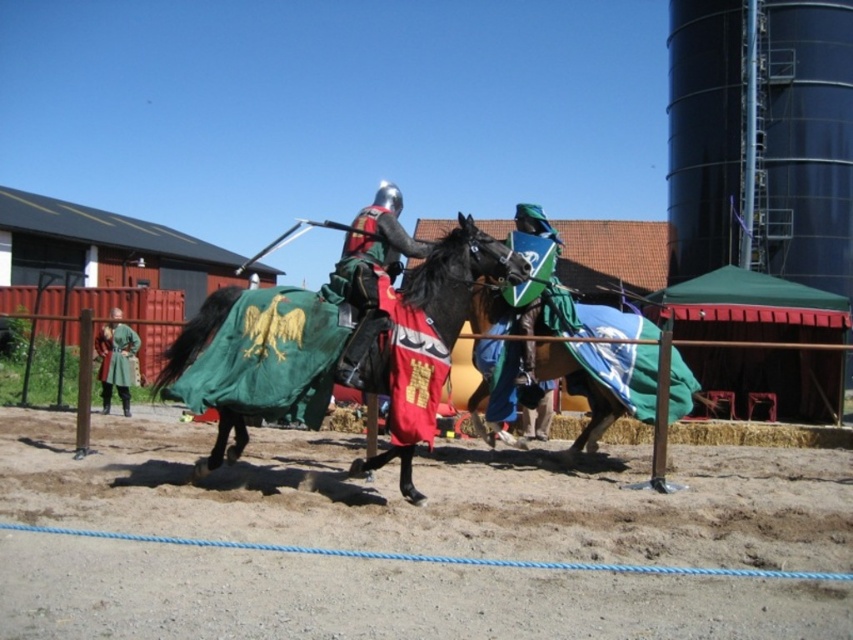
Does brown sandy dirt at center have a greater width compared to green leather jacket at left?

Indeed, brown sandy dirt at center has a greater width compared to green leather jacket at left.

Between brown sandy dirt at center and green leather jacket at left, which one has more height?

green leather jacket at left

Locate an element on the screen. The height and width of the screenshot is (640, 853). brown sandy dirt at center is located at coordinates (432, 497).

Identify the location of brown sandy dirt at center. This screenshot has height=640, width=853. (432, 497).

Between shiny metallic armor at center and shiny brown horse at center, which one has less height?

With less height is shiny brown horse at center.

From the picture: Who is more forward, (364,308) or (474,417)?

Point (364,308)

Is point (392, 257) closer to viewer compared to point (581, 435)?

Yes.

Where is `shiny metallic armor at center`? shiny metallic armor at center is located at coordinates (369, 273).

Can you confirm if green velvet horse at center is shorter than shiny green shield at center?

Yes.

Between green velvet horse at center and shiny green shield at center, which one appears on the right side from the viewer's perspective?

Positioned to the right is shiny green shield at center.

Which is behind, point (262, 352) or point (546, 280)?

The point (546, 280) is behind.

Locate an element on the screen. Image resolution: width=853 pixels, height=640 pixels. green velvet horse at center is located at coordinates (254, 360).